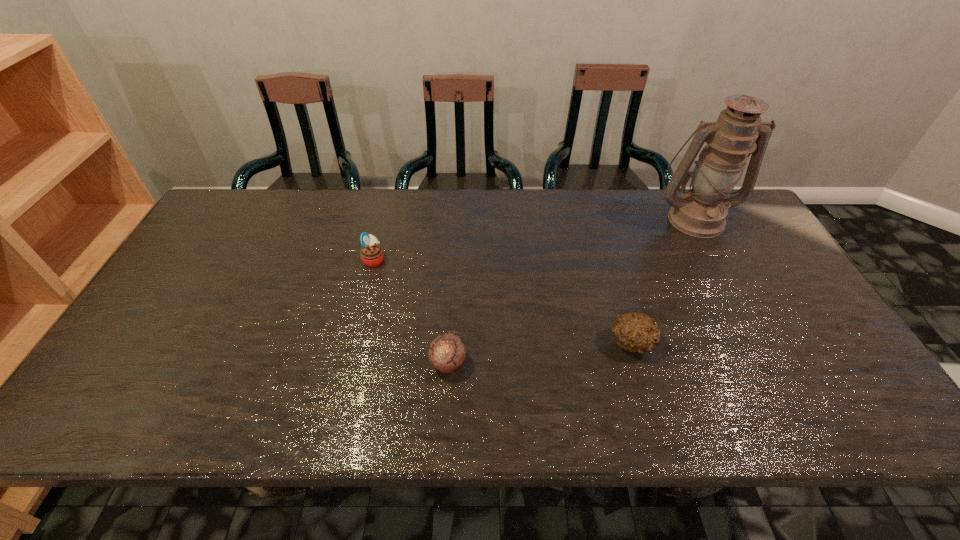
Where is `free space that is in between the second muffin from left to right and the rightmost object`? The width and height of the screenshot is (960, 540). free space that is in between the second muffin from left to right and the rightmost object is located at coordinates (571, 291).

I want to click on vacant space in between the oil lamp and the tallest muffin, so click(535, 239).

I want to click on vacant space that's between the second muffin from right to left and the third shortest object, so click(411, 312).

What are the coordinates of `free space between the second muffin from left to right and the second object from right to left` in the screenshot? It's located at (540, 353).

Where is `vacant area that lies between the farthest object and the leftmost object`? This screenshot has height=540, width=960. vacant area that lies between the farthest object and the leftmost object is located at coordinates (535, 239).

You are a GUI agent. You are given a task and a screenshot of the screen. Output one action in this format:
    pyautogui.click(x=<x>, y=<y>)
    Task: Click on the free space between the rightmost muffin and the farthest muffin
    
    Given the screenshot: What is the action you would take?
    pyautogui.click(x=503, y=301)

This screenshot has height=540, width=960. I want to click on vacant space that is in between the rightmost muffin and the tallest object, so click(663, 281).

What are the coordinates of `object that is the third closest one to the rightmost object` in the screenshot? It's located at (372, 255).

This screenshot has width=960, height=540. I want to click on object that can be found as the second closest to the third object from right to left, so click(635, 332).

This screenshot has height=540, width=960. Identify the location of muffin that stands as the second closest to the third shortest object. (635, 332).